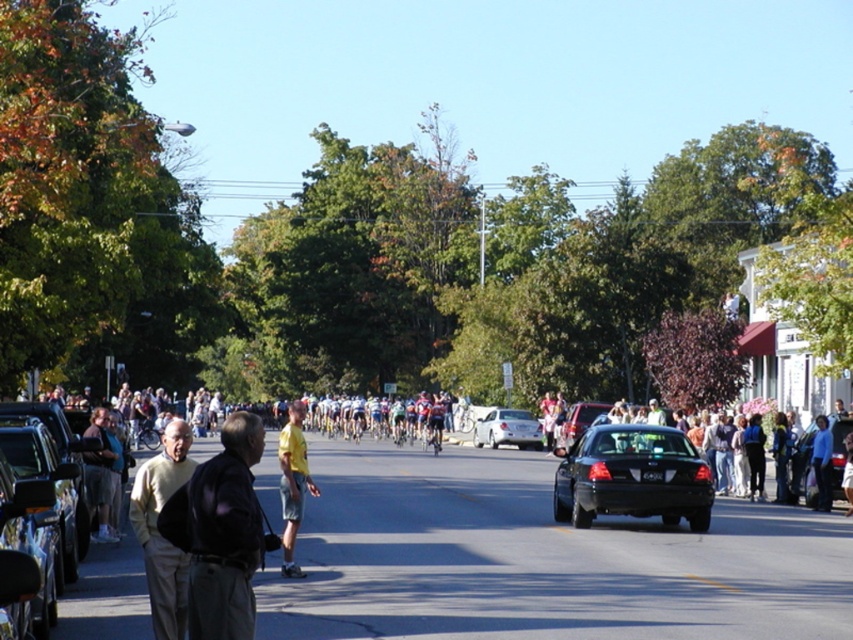
Question: Which point appears farthest from the camera in this image?

Choices:
 (A) (184, 426)
 (B) (668, 428)
 (C) (294, 477)

Answer: (B)

Question: Which point appears farthest from the camera in this image?

Choices:
 (A) (842, 448)
 (B) (293, 419)

Answer: (A)

Question: Is yellow fabric shirt at center in front of metallic black truck at left?

Choices:
 (A) yes
 (B) no

Answer: (B)

Question: Is white matte sedan at center further to the viewer compared to blue shirt at right?

Choices:
 (A) yes
 (B) no

Answer: (A)

Question: Can you confirm if metallic silver car at left is wider than matte black sedan at center?

Choices:
 (A) yes
 (B) no

Answer: (A)

Question: Which of the following is the farthest from the observer?

Choices:
 (A) (190, 440)
 (B) (283, 561)

Answer: (B)